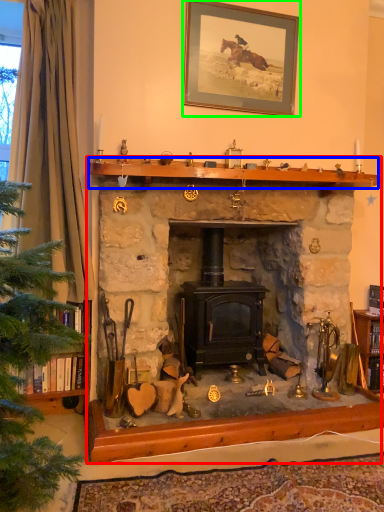
Question: Which object is the farthest from fireplace (highlighted by a red box)? Choose among these: mantle (highlighted by a blue box) or picture frame (highlighted by a green box).

Choices:
 (A) mantle
 (B) picture frame

Answer: (B)